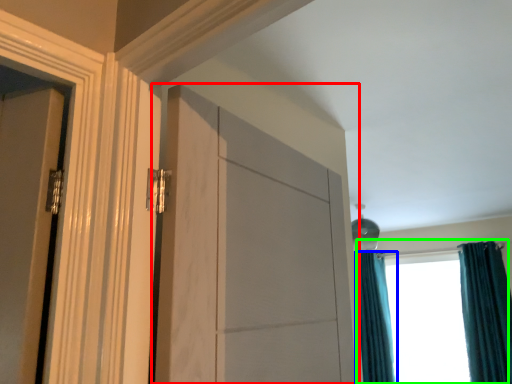
Question: Which object is positioned farthest from door (highlighted by a red box)? Select from curtain (highlighted by a blue box) and window (highlighted by a green box).

Choices:
 (A) curtain
 (B) window

Answer: (A)